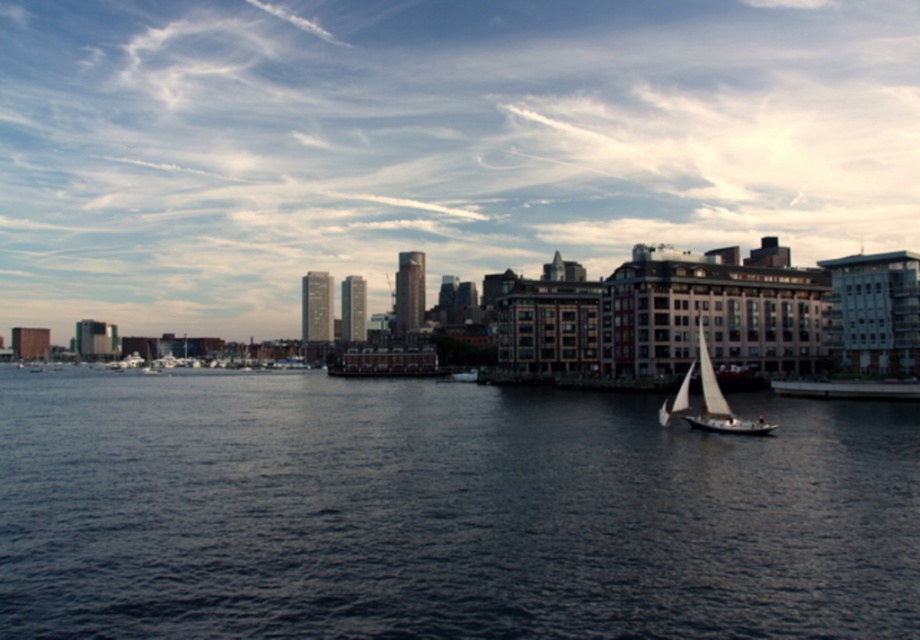
Which is behind, point (703, 449) or point (723, 429)?

The point (723, 429) is more distant.

The height and width of the screenshot is (640, 920). I want to click on dark blue water at center, so click(443, 513).

Which is behind, point (190, 588) or point (731, 429)?

Point (731, 429)

At what (x,y) coordinates should I click in order to perform the action: click on dark blue water at center. Please return your answer as a coordinate pair (x, y). This screenshot has width=920, height=640. Looking at the image, I should click on (443, 513).